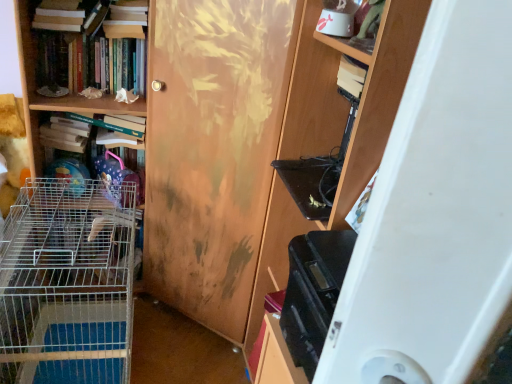
Question: In terms of width, does silver wire cage at left look wider or thinner when compared to matte white book at upper left, which appears as the first book when viewed from the top?

Choices:
 (A) wide
 (B) thin

Answer: (A)

Question: Is silver wire cage at left bigger or smaller than matte white book at upper left, positioned as the 3th book in bottom-to-top order?

Choices:
 (A) small
 (B) big

Answer: (B)

Question: Estimate the real-world distances between objects in this image. Which object is closer to the matte white book at upper left, positioned as the 3th book in bottom-to-top order?

Choices:
 (A) metal wire cage at left
 (B) hardcover books at upper left, which is the 2th book from top to bottom
 (C) wooden door at center
 (D) wooden shelf at right
 (E) hardcover book at left, the third book in the top-to-bottom sequence

Answer: (B)

Question: Which of these objects is positioned farthest from the metal wire cage at left?

Choices:
 (A) matte white book at upper left, positioned as the 3th book in bottom-to-top order
 (B) hardcover book at left, the third book in the top-to-bottom sequence
 (C) wooden door at center
 (D) hardcover books at upper left, positioned as the 2th book in bottom-to-top order
 (E) silver wire cage at left

Answer: (E)